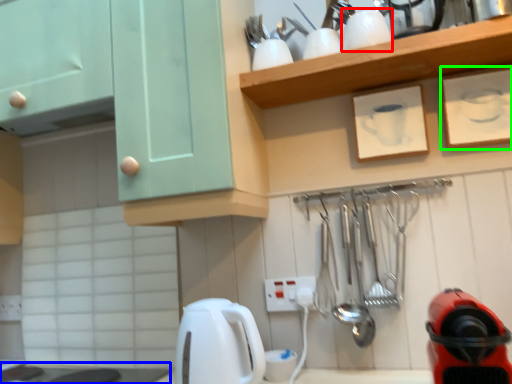
Question: Which object is the farthest from appliance (highlighted by a red box)? Choose among these: counter top (highlighted by a blue box) or picture frame (highlighted by a green box).

Choices:
 (A) counter top
 (B) picture frame

Answer: (A)